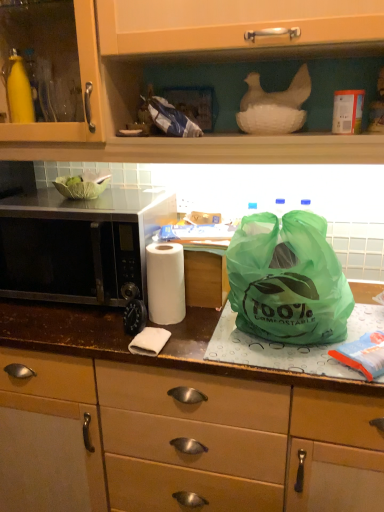
Question: From their relative heights in the image, would you say green plastic bag at center, the first cabinetry in the bottom-to-top sequence, is taller or shorter than matte wood cabinet at upper center, placed as the second cabinetry when sorted from bottom to top?

Choices:
 (A) tall
 (B) short

Answer: (A)

Question: Visually, is green plastic bag at center, acting as the 2th cabinetry starting from the top, positioned to the left or to the right of matte wood cabinet at upper center, placed as the second cabinetry when sorted from bottom to top?

Choices:
 (A) right
 (B) left

Answer: (A)

Question: Which object is positioned closest to the matte wood cabinet at upper center, placed as the second cabinetry when sorted from bottom to top?

Choices:
 (A) green compostable bag at center
 (B) black matte microwave at left
 (C) green plastic bag at center, the first cabinetry in the bottom-to-top sequence
 (D) white matte paper towel at center

Answer: (B)

Question: Based on their relative distances, which object is farther from the green plastic bag at center, the first cabinetry in the bottom-to-top sequence?

Choices:
 (A) green compostable bag at center
 (B) matte wood cabinet at upper center, the first cabinetry from the top
 (C) white matte paper towel at center
 (D) black matte microwave at left

Answer: (B)